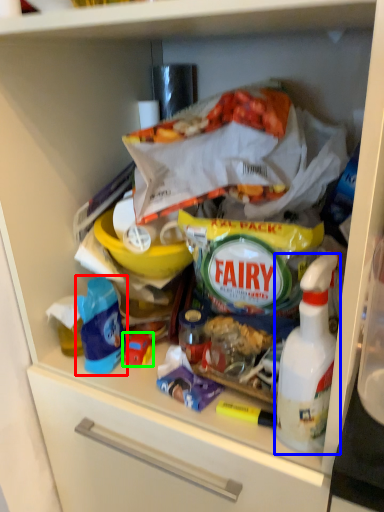
Question: Which object is positioned closest to product (highlighted by a red box)? Select from bottle (highlighted by a blue box) and toy (highlighted by a green box).

Choices:
 (A) bottle
 (B) toy

Answer: (B)